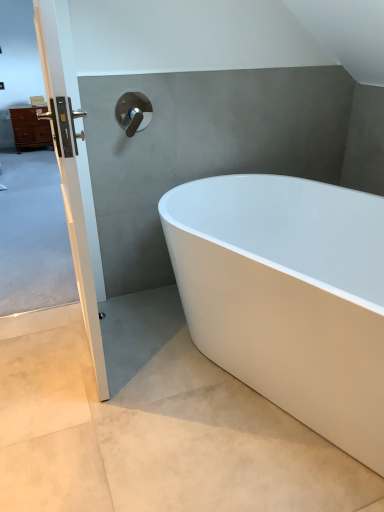
Question: Should I look upward or downward to see white smooth concrete at lower right?

Choices:
 (A) down
 (B) up

Answer: (A)

Question: Is white glossy door handle at left to the left of white smooth concrete at lower right from the viewer's perspective?

Choices:
 (A) yes
 (B) no

Answer: (A)

Question: Does white glossy door handle at left have a larger size compared to white smooth concrete at lower right?

Choices:
 (A) yes
 (B) no

Answer: (A)

Question: Considering the relative sizes of white glossy door handle at left and white smooth concrete at lower right in the image provided, is white glossy door handle at left shorter than white smooth concrete at lower right?

Choices:
 (A) yes
 (B) no

Answer: (B)

Question: Is the position of white glossy door handle at left less distant than that of white smooth concrete at lower right?

Choices:
 (A) yes
 (B) no

Answer: (B)

Question: Can you confirm if white glossy door handle at left is wider than white smooth concrete at lower right?

Choices:
 (A) yes
 (B) no

Answer: (B)

Question: From a real-world perspective, is white glossy door handle at left physically above white smooth concrete at lower right?

Choices:
 (A) yes
 (B) no

Answer: (A)

Question: Is matte brown chest of drawers at left facing towards white glossy bathtub at center?

Choices:
 (A) yes
 (B) no

Answer: (A)

Question: Considering the relative sizes of matte brown chest of drawers at left and white glossy bathtub at center in the image provided, is matte brown chest of drawers at left wider than white glossy bathtub at center?

Choices:
 (A) yes
 (B) no

Answer: (B)

Question: Are matte brown chest of drawers at left and white glossy bathtub at center located far from each other?

Choices:
 (A) yes
 (B) no

Answer: (A)

Question: Is matte brown chest of drawers at left turned away from white glossy bathtub at center?

Choices:
 (A) no
 (B) yes

Answer: (A)

Question: From the image's perspective, is matte brown chest of drawers at left beneath white glossy bathtub at center?

Choices:
 (A) no
 (B) yes

Answer: (A)

Question: Considering the relative positions of matte brown chest of drawers at left and white glossy bathtub at center in the image provided, is matte brown chest of drawers at left to the right of white glossy bathtub at center from the viewer's perspective?

Choices:
 (A) no
 (B) yes

Answer: (A)

Question: Is white smooth concrete at lower right aimed at polished chrome faucet at upper center?

Choices:
 (A) no
 (B) yes

Answer: (A)